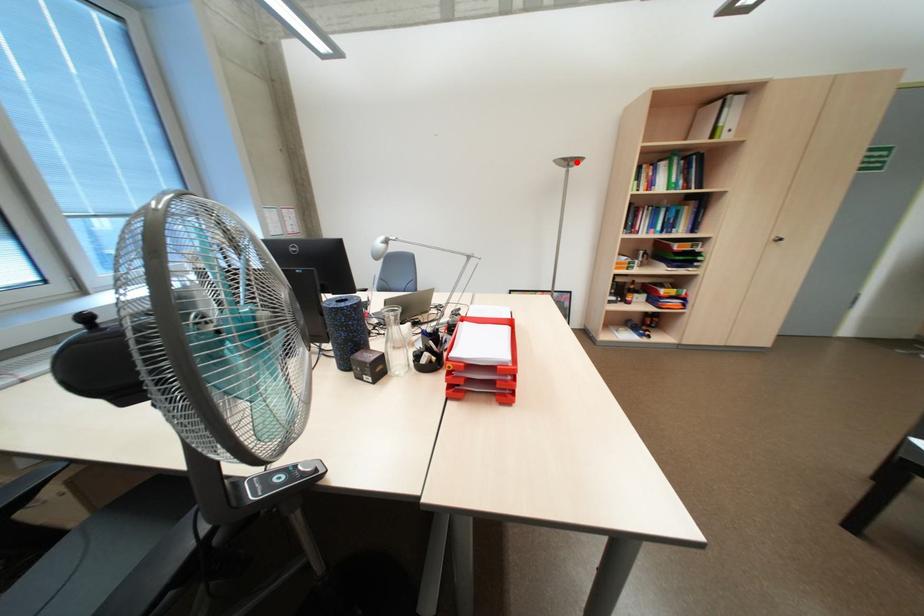
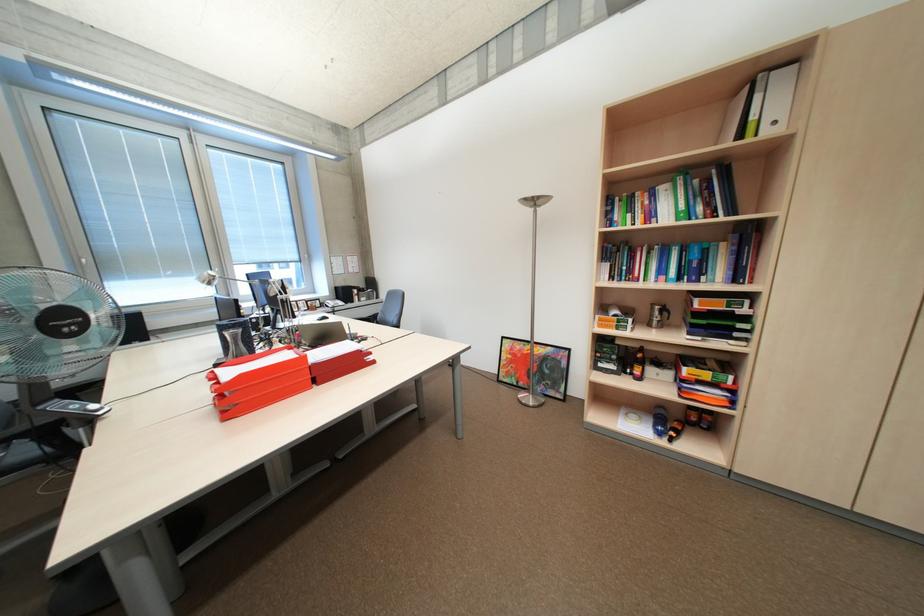
In the second image, find the point that corresponds to the highlighted location in the first image.

(542, 203)